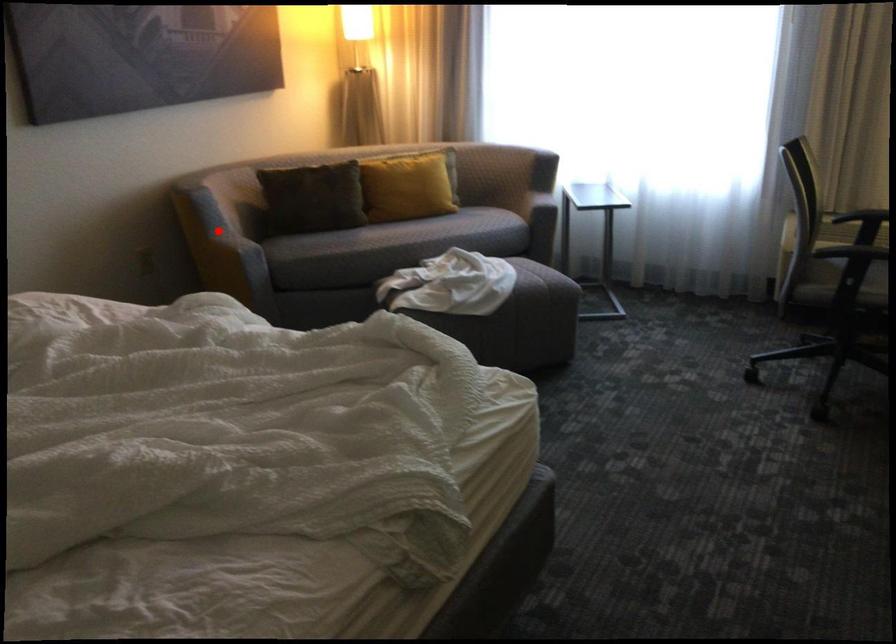
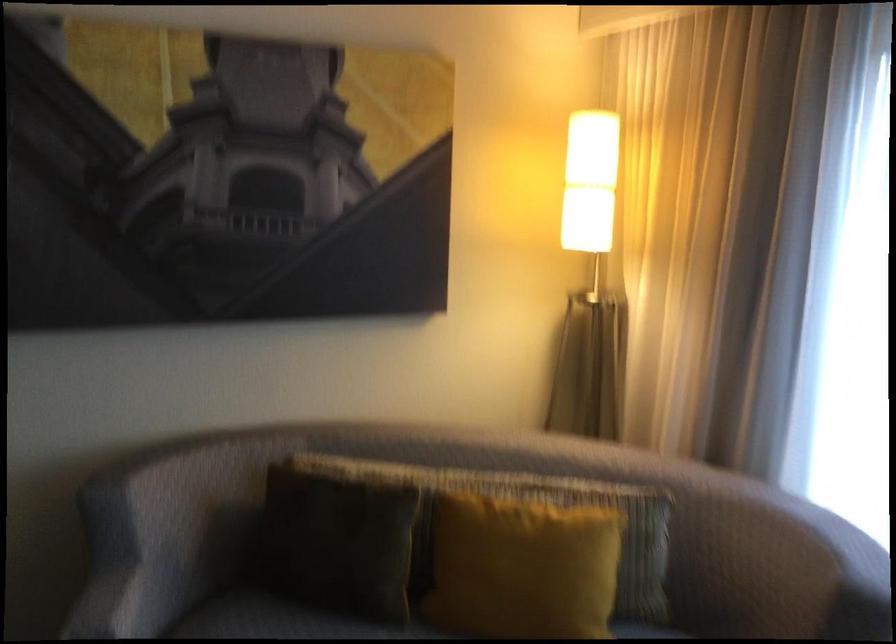
Question: I am providing you with two images of the same scene from different viewpoints. A red point is shown in image1. For the corresponding object point in image2, is it positioned nearer or farther from the camera?

Choices:
 (A) Nearer
 (B) Farther

Answer: (A)